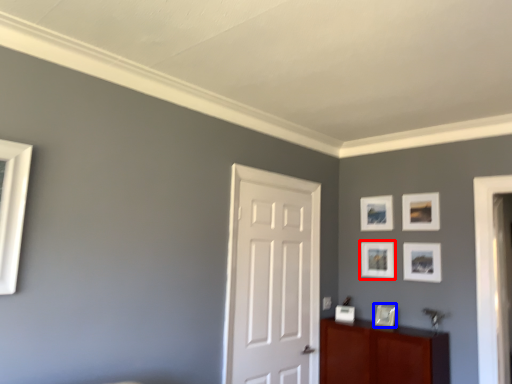
Question: Among these objects, which one is nearest to the camera, picture frame (highlighted by a red box) or picture frame (highlighted by a blue box)?

Choices:
 (A) picture frame
 (B) picture frame

Answer: (B)